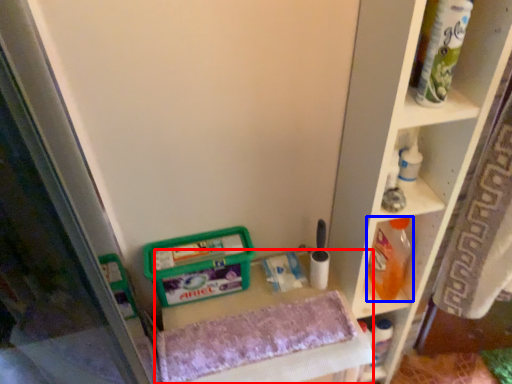
Question: Which of the following is the farthest to the observer, vanity (highlighted by a red box) or cleaning product (highlighted by a blue box)?

Choices:
 (A) vanity
 (B) cleaning product

Answer: (B)